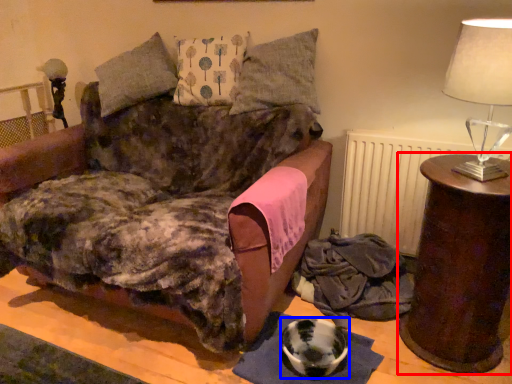
Question: Which point is further to the camera, table (highlighted by a red box) or bowl (highlighted by a blue box)?

Choices:
 (A) table
 (B) bowl

Answer: (B)